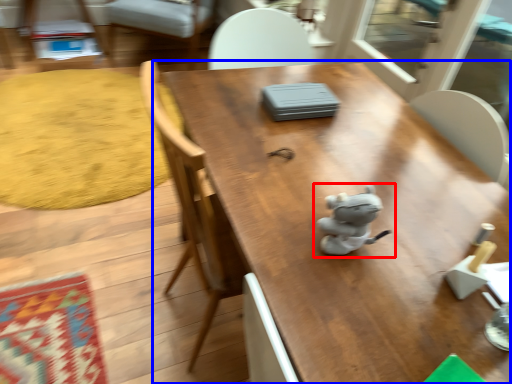
Question: Among these objects, which one is nearest to the camera, toy (highlighted by a red box) or table (highlighted by a blue box)?

Choices:
 (A) toy
 (B) table

Answer: (B)